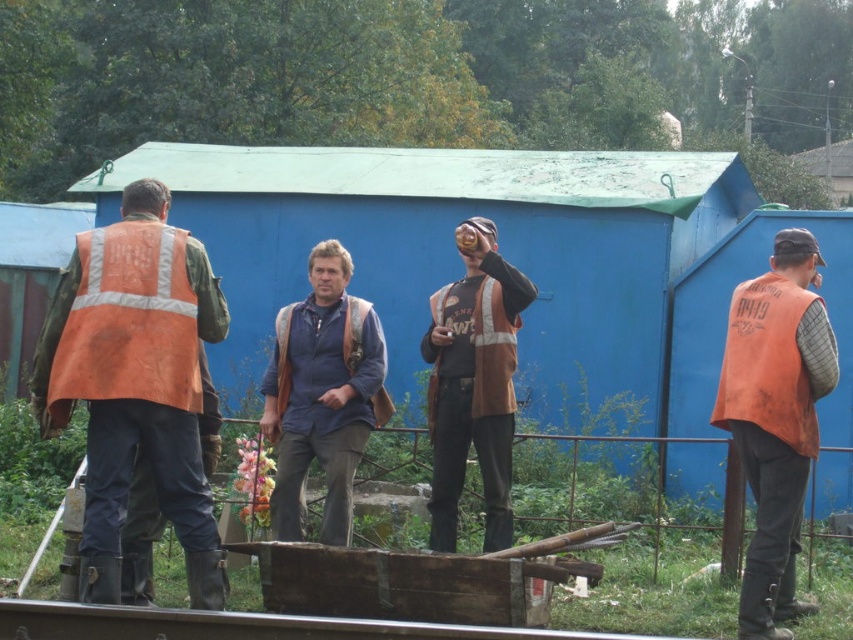
Who is more distant from viewer, (151, 364) or (279, 376)?

Positioned behind is point (279, 376).

Which of these two, orange reflective safety vest at left or orange fabric safety vest at center, stands taller?

With more height is orange reflective safety vest at left.

Which is behind, point (73, 376) or point (277, 406)?

Positioned behind is point (277, 406).

The image size is (853, 640). What are the coordinates of `orange reflective safety vest at left` in the screenshot? It's located at (128, 323).

Consider the image. Between orange reflective safety vest at center and orange fabric safety vest at center, which one appears on the left side from the viewer's perspective?

orange fabric safety vest at center is more to the left.

Is orange reflective safety vest at center further to camera compared to orange fabric safety vest at center?

Yes.

Which is in front, point (483, 330) or point (345, 324)?

Point (345, 324)

Where is `orange reflective safety vest at center`? orange reflective safety vest at center is located at coordinates (492, 352).

Is blue denim shirt at center positioned in front of brown leather jacket at center?

Yes.

Who is lower down, blue denim shirt at center or brown leather jacket at center?

Positioned lower is brown leather jacket at center.

Who is more distant from viewer, (369, 401) or (490, 275)?

Positioned behind is point (369, 401).

This screenshot has width=853, height=640. I want to click on blue denim shirt at center, so click(x=322, y=394).